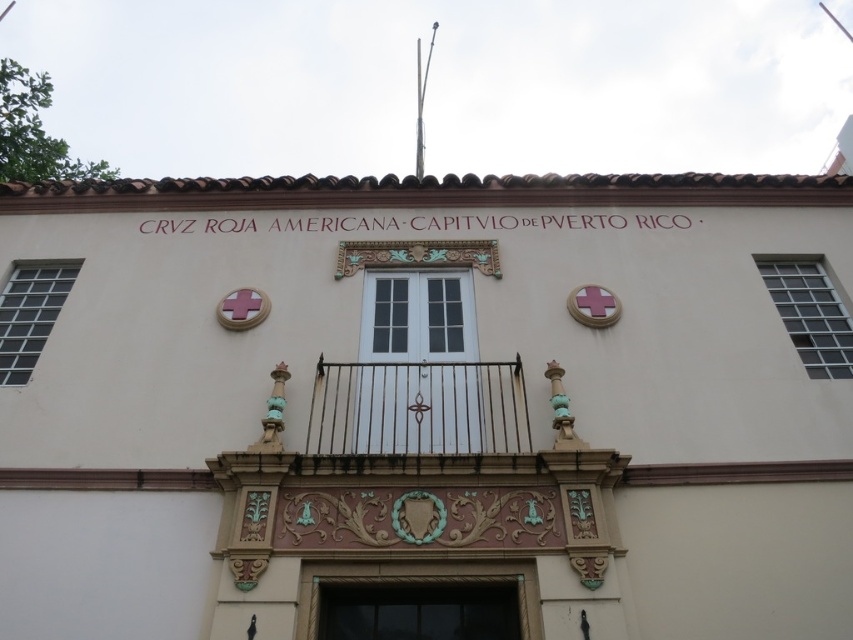
Question: Which of the following is the farthest from the observer?

Choices:
 (A) (363, 632)
 (B) (410, 362)

Answer: (B)

Question: Can you confirm if white painted wood door at center is thinner than brown textured door at center?

Choices:
 (A) no
 (B) yes

Answer: (B)

Question: Is white painted wood door at center bigger than brown textured door at center?

Choices:
 (A) yes
 (B) no

Answer: (B)

Question: Can you confirm if white painted wood door at center is positioned to the right of brown textured door at center?

Choices:
 (A) no
 (B) yes

Answer: (A)

Question: Which point appears farthest from the camera in this image?

Choices:
 (A) pyautogui.click(x=381, y=369)
 (B) pyautogui.click(x=521, y=577)

Answer: (A)